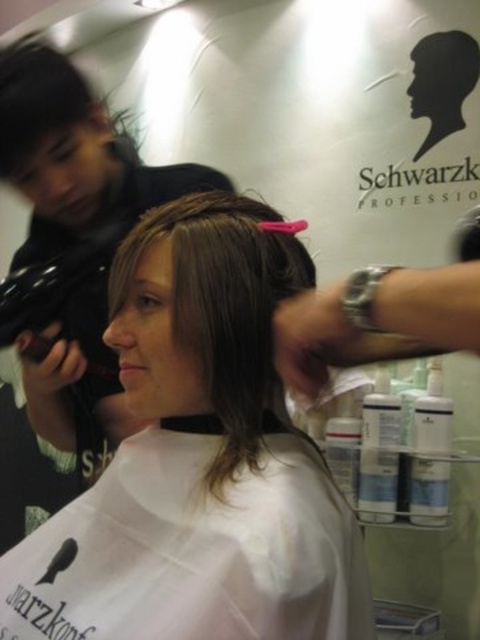
Question: Can you confirm if smooth brown hair at center is positioned below pink plastic comb at upper center?

Choices:
 (A) yes
 (B) no

Answer: (A)

Question: Which point is closer to the camera?

Choices:
 (A) (180, 348)
 (B) (183, 333)
 (C) (300, 380)

Answer: (C)

Question: Which point is farther to the camera?

Choices:
 (A) (199, 221)
 (B) (322, 337)
 (C) (140, 264)

Answer: (C)

Question: Which object is closer to the camera taking this photo?

Choices:
 (A) pink plastic comb at upper center
 (B) brown matte hair clip at center
 (C) smooth brown hair at center

Answer: (A)

Question: Does brown matte hair clip at center come in front of pink plastic comb at upper center?

Choices:
 (A) no
 (B) yes

Answer: (A)

Question: Does smooth brown hair at center appear under pink plastic comb at upper center?

Choices:
 (A) no
 (B) yes

Answer: (B)